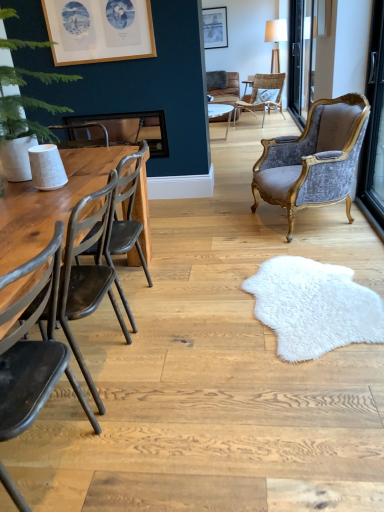
At what (x,y) coordinates should I click in order to perform the action: click on matte silver picture frame at upper center, positioned as the 1th picture frame in right-to-left order. Please return your answer as a coordinate pair (x, y). The width and height of the screenshot is (384, 512). Looking at the image, I should click on (215, 27).

Describe the element at coordinates (302, 58) in the screenshot. This screenshot has width=384, height=512. I see `transparent glass door at upper right` at that location.

Measure the distance between transparent glass door at upper right and camera.

The depth of transparent glass door at upper right is 4.06 meters.

Where is `matte black chair at left, the fourth chair from the back`? This screenshot has height=512, width=384. matte black chair at left, the fourth chair from the back is located at coordinates (34, 348).

The width and height of the screenshot is (384, 512). Describe the element at coordinates (34, 348) in the screenshot. I see `matte black chair at left, positioned as the 1th chair in front-to-back order` at that location.

The height and width of the screenshot is (512, 384). What do you see at coordinates (50, 203) in the screenshot?
I see `wooden table at left` at bounding box center [50, 203].

Find the location of a particular element. Image resolution: width=384 pixels, height=512 pixels. matte silver picture frame at upper center, acting as the 2th picture frame starting from the bottom is located at coordinates (215, 27).

Does green leafy plant at left lie behind matte silver picture frame at upper center, the 2th picture frame when ordered from left to right?

No, it is in front of matte silver picture frame at upper center, the 2th picture frame when ordered from left to right.

Looking at this image, from the image's perspective, is green leafy plant at left beneath matte silver picture frame at upper center, positioned as the 1th picture frame in right-to-left order?

Yes, from the image's perspective, green leafy plant at left is beneath matte silver picture frame at upper center, positioned as the 1th picture frame in right-to-left order.

Considering the relative positions of green leafy plant at left and matte silver picture frame at upper center, positioned as the 1th picture frame in right-to-left order, in the image provided, is green leafy plant at left to the left of matte silver picture frame at upper center, positioned as the 1th picture frame in right-to-left order, from the viewer's perspective?

Correct, you'll find green leafy plant at left to the left of matte silver picture frame at upper center, positioned as the 1th picture frame in right-to-left order.

From a real-world perspective, is green leafy plant at left above or below matte silver picture frame at upper center, the 2th picture frame when ordered from left to right?

In terms of real-world spatial position, green leafy plant at left is below matte silver picture frame at upper center, the 2th picture frame when ordered from left to right.

What's the angular difference between transparent glass door at upper right and dark brown wood chair at left, arranged as the second chair when viewed from the front,'s facing directions?

The angle between the facing direction of transparent glass door at upper right and the facing direction of dark brown wood chair at left, arranged as the second chair when viewed from the front, is 2.07 degrees.

Relative to dark brown wood chair at left, acting as the second chair starting from the bottom, is transparent glass door at upper right in front or behind?

transparent glass door at upper right is behind dark brown wood chair at left, acting as the second chair starting from the bottom.

From a real-world perspective, is transparent glass door at upper right positioned over dark brown wood chair at left, acting as the second chair starting from the bottom, based on gravity?

Yes, from a real-world perspective, transparent glass door at upper right is above dark brown wood chair at left, acting as the second chair starting from the bottom.

Is green leafy plant at left with wooden table at left?

No.

From a real-world perspective, does green leafy plant at left stand above wooden table at left?

Yes, from a real-world perspective, green leafy plant at left is above wooden table at left.

Would you say green leafy plant at left is to the left or to the right of wooden table at left in the picture?

Clearly, green leafy plant at left is on the left of wooden table at left in the image.

The image size is (384, 512). Find the location of `the 2nd picture frame positioned above the wooden table at left (from the image's perspective)`. the 2nd picture frame positioned above the wooden table at left (from the image's perspective) is located at coordinates (215, 27).

From the image's perspective, is wooden table at left on matte silver picture frame at upper center, which ranks as the 1th picture frame in back-to-front order?

No, from the image's perspective, wooden table at left is not above matte silver picture frame at upper center, which ranks as the 1th picture frame in back-to-front order.

Considering the sizes of objects wooden table at left and matte silver picture frame at upper center, acting as the 2th picture frame starting from the bottom, in the image provided, who is thinner, wooden table at left or matte silver picture frame at upper center, acting as the 2th picture frame starting from the bottom,?

With smaller width is matte silver picture frame at upper center, acting as the 2th picture frame starting from the bottom.

Can you confirm if wooden table at left is taller than matte silver picture frame at upper center, placed as the second picture frame when sorted from front to back?

Yes.

Looking at their sizes, would you say wooden frame at upper left, which appears as the 1th picture frame when viewed from the left, is wider or thinner than wooden table at left?

wooden frame at upper left, which appears as the 1th picture frame when viewed from the left, is thinner than wooden table at left.

Based on the photo, from the image's perspective, which object appears higher, wooden frame at upper left, the 2th picture frame viewed from the right, or wooden table at left?

wooden frame at upper left, the 2th picture frame viewed from the right, appears higher in the image.

Considering the relative sizes of wooden frame at upper left, the 2th picture frame viewed from the right, and wooden table at left in the image provided, is wooden frame at upper left, the 2th picture frame viewed from the right, taller than wooden table at left?

No.

Is wooden frame at upper left, arranged as the 2th picture frame when viewed from the top, turned away from wooden table at left?

wooden frame at upper left, arranged as the 2th picture frame when viewed from the top, does not have its back to wooden table at left.

From the image's perspective, is dark brown wood chair at left, the 3th chair when ordered from top to bottom, on top of wooden frame at upper left, acting as the 1th picture frame starting from the front?

No.

Can we say dark brown wood chair at left, positioned as the third chair in back-to-front order, lies outside wooden frame at upper left, arranged as the second picture frame when viewed from the back?

Indeed, dark brown wood chair at left, positioned as the third chair in back-to-front order, is completely outside wooden frame at upper left, arranged as the second picture frame when viewed from the back.

How far apart are dark brown wood chair at left, positioned as the third chair in back-to-front order, and wooden frame at upper left, which appears as the 1th picture frame when viewed from the left?

dark brown wood chair at left, positioned as the third chair in back-to-front order, and wooden frame at upper left, which appears as the 1th picture frame when viewed from the left, are 7.78 feet apart.

Looking at their sizes, would you say rattan wicker chair at center, acting as the 1th chair starting from the top, is wider or thinner than matte black chair at left, the fourth chair from the back?

Clearly, rattan wicker chair at center, acting as the 1th chair starting from the top, has more width compared to matte black chair at left, the fourth chair from the back.

Which of these two, rattan wicker chair at center, the 4th chair positioned from the bottom, or matte black chair at left, the fourth chair from the back, is smaller?

Smaller between the two is matte black chair at left, the fourth chair from the back.

In the scene shown: Considering the sizes of rattan wicker chair at center, placed as the fourth chair when sorted from front to back, and matte black chair at left, the fourth chair from the back, in the image, is rattan wicker chair at center, placed as the fourth chair when sorted from front to back, taller or shorter than matte black chair at left, the fourth chair from the back,?

In the image, rattan wicker chair at center, placed as the fourth chair when sorted from front to back, appears to be shorter than matte black chair at left, the fourth chair from the back.

Where is `plant lying on the left of matte silver picture frame at upper center, which ranks as the 1th picture frame in back-to-front order`? plant lying on the left of matte silver picture frame at upper center, which ranks as the 1th picture frame in back-to-front order is located at coordinates (26, 104).

In order to click on window screen above the dark brown wood chair at left, arranged as the second chair when viewed from the front (from the image's perspective) in this screenshot , I will do (x=302, y=58).

When comparing their distances from wooden frame at upper left, the 2th picture frame viewed from the right, does transparent glass door at upper right or green leafy plant at left seem closer?

green leafy plant at left.

Considering their positions, is matte black chair at left, marked as the fourth chair in a top-to-bottom arrangement, positioned further to green leafy plant at left than dark brown wood chair at left, the 3th chair when ordered from top to bottom?

Among the two, matte black chair at left, marked as the fourth chair in a top-to-bottom arrangement, is located further to green leafy plant at left.

From the image, which object appears to be farther from transparent glass door at upper right, velvet/gold armchair at right, which is the 3th chair in front-to-back order, or matte silver picture frame at upper center, positioned as the 1th picture frame in right-to-left order?

matte silver picture frame at upper center, positioned as the 1th picture frame in right-to-left order.

From the image, which object appears to be nearer to matte silver picture frame at upper center, acting as the 2th picture frame starting from the bottom, velvet/gold armchair at right, which is the 3th chair in front-to-back order, or green leafy plant at left?

velvet/gold armchair at right, which is the 3th chair in front-to-back order, lies closer to matte silver picture frame at upper center, acting as the 2th picture frame starting from the bottom, than the other object.

When comparing their distances from wooden table at left, does dark brown wood chair at left, positioned as the third chair in back-to-front order, or wooden frame at upper left, the 2th picture frame viewed from the right, seem closer?

dark brown wood chair at left, positioned as the third chair in back-to-front order.

Based on their spatial positions, is matte black chair at left, the 1th chair from the bottom, or dark brown wood chair at left, the 3th chair when ordered from top to bottom, further from wooden frame at upper left, acting as the 1th picture frame starting from the front?

matte black chair at left, the 1th chair from the bottom, is positioned further to the anchor wooden frame at upper left, acting as the 1th picture frame starting from the front.

From the picture: Based on their spatial positions, is matte silver picture frame at upper center, placed as the second picture frame when sorted from front to back, or velvet/gold armchair at right, which is the 3th chair in front-to-back order, further from dark brown wood chair at left, arranged as the second chair when viewed from the front?

matte silver picture frame at upper center, placed as the second picture frame when sorted from front to back, lies further to dark brown wood chair at left, arranged as the second chair when viewed from the front, than the other object.

Which object lies further to the anchor point matte silver picture frame at upper center, which ranks as the 1th picture frame in back-to-front order, wooden table at left or dark brown wood chair at left, arranged as the second chair when viewed from the front?

Among the two, dark brown wood chair at left, arranged as the second chair when viewed from the front, is located further to matte silver picture frame at upper center, which ranks as the 1th picture frame in back-to-front order.

I want to click on table between matte black chair at left, positioned as the 1th chair in front-to-back order, and wooden frame at upper left, the 2th picture frame viewed from the right, along the z-axis, so click(x=50, y=203).

Locate an element on the screen. The width and height of the screenshot is (384, 512). chair positioned between dark brown wood chair at left, acting as the second chair starting from the bottom, and wooden frame at upper left, arranged as the 2th picture frame when viewed from the top, from near to far is located at coordinates (314, 159).

Find the location of a particular element. This screenshot has height=512, width=384. picture frame positioned between wooden table at left and rattan wicker chair at center, the 4th chair positioned from the bottom, from near to far is located at coordinates (99, 30).

You are a GUI agent. You are given a task and a screenshot of the screen. Output one action in this format:
    pyautogui.click(x=<x>, y=<y>)
    Task: Click on the table between dark brown wood chair at left, arranged as the second chair when viewed from the front, and transparent glass door at upper right from front to back
    
    Given the screenshot: What is the action you would take?
    pyautogui.click(x=50, y=203)